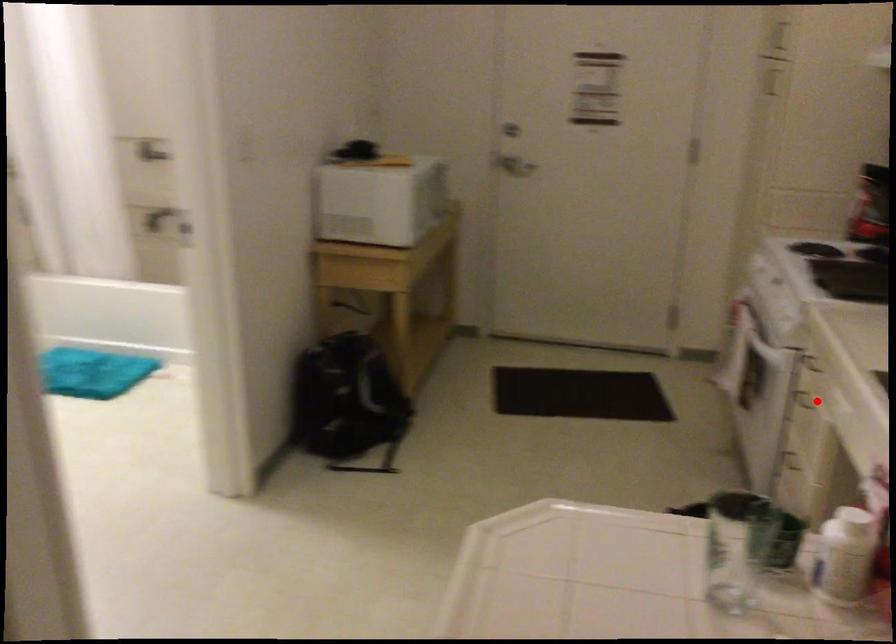
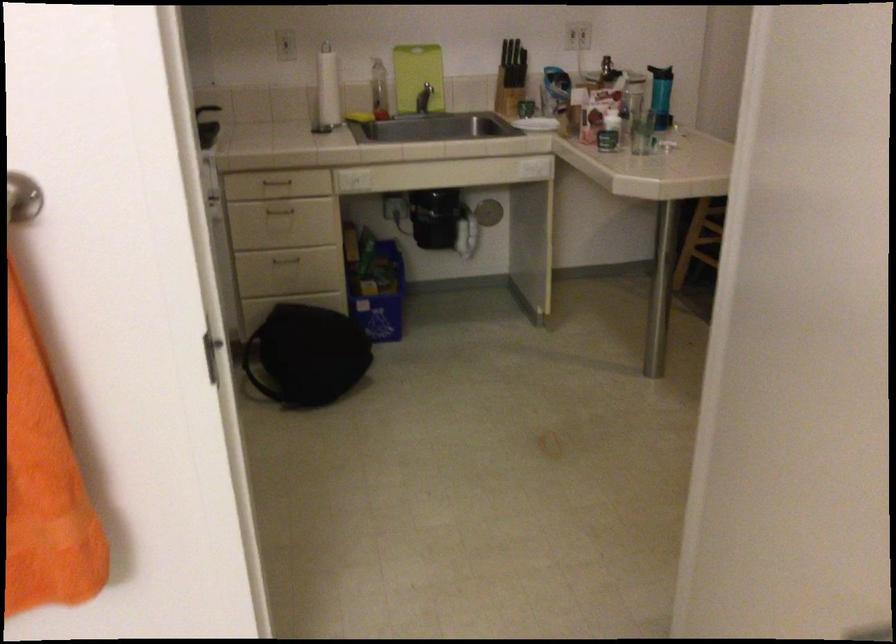
Question: I am providing you with two images of the same scene from different viewpoints. A red point is shown in image1. For the corresponding object point in image2, is it positioned nearer or farther from the camera?

Choices:
 (A) Nearer
 (B) Farther

Answer: (B)